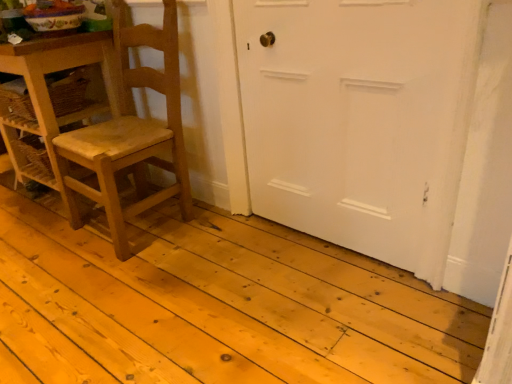
The image size is (512, 384). I want to click on free space in front of wooden table at left, so click(45, 249).